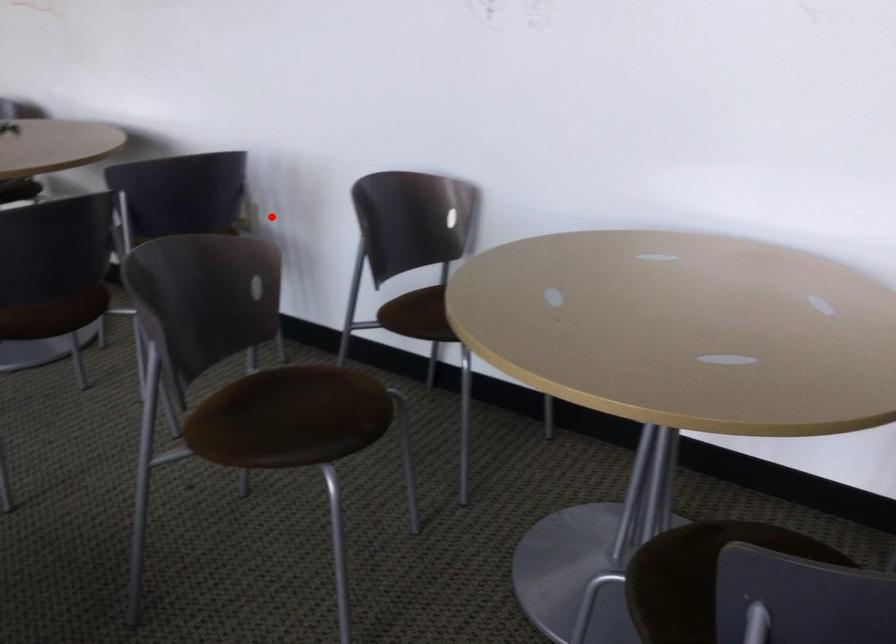
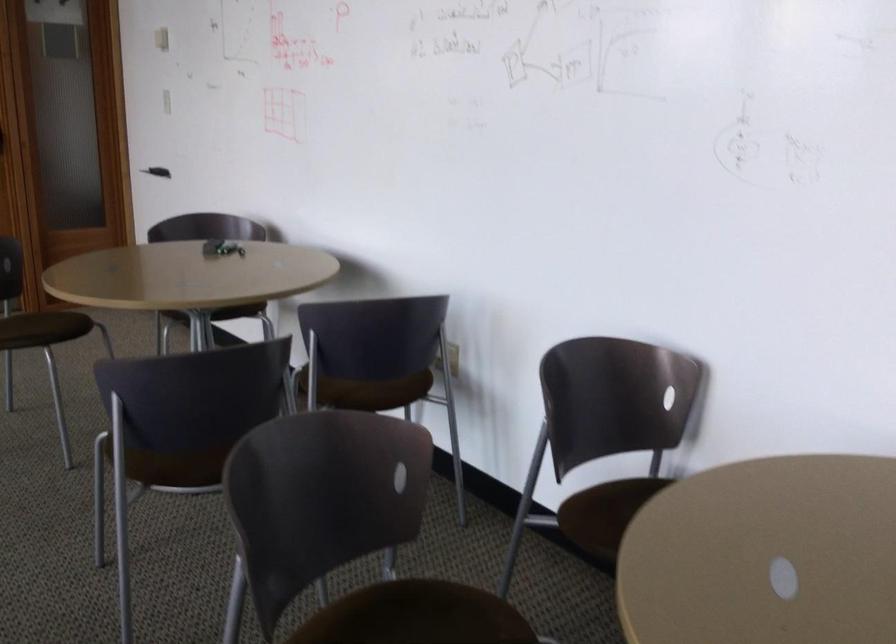
Locate, in the second image, the point that corresponds to the highlighted location in the first image.

(452, 359)